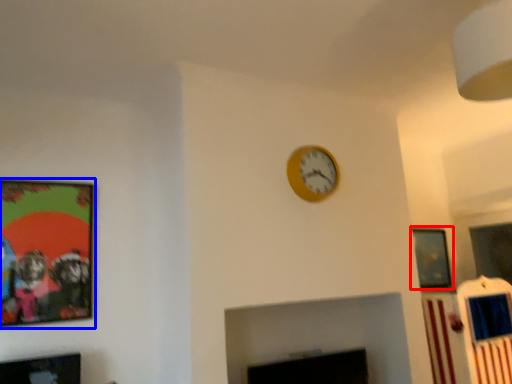
Question: Among these objects, which one is farthest to the camera, picture frame (highlighted by a red box) or picture frame (highlighted by a blue box)?

Choices:
 (A) picture frame
 (B) picture frame

Answer: (A)